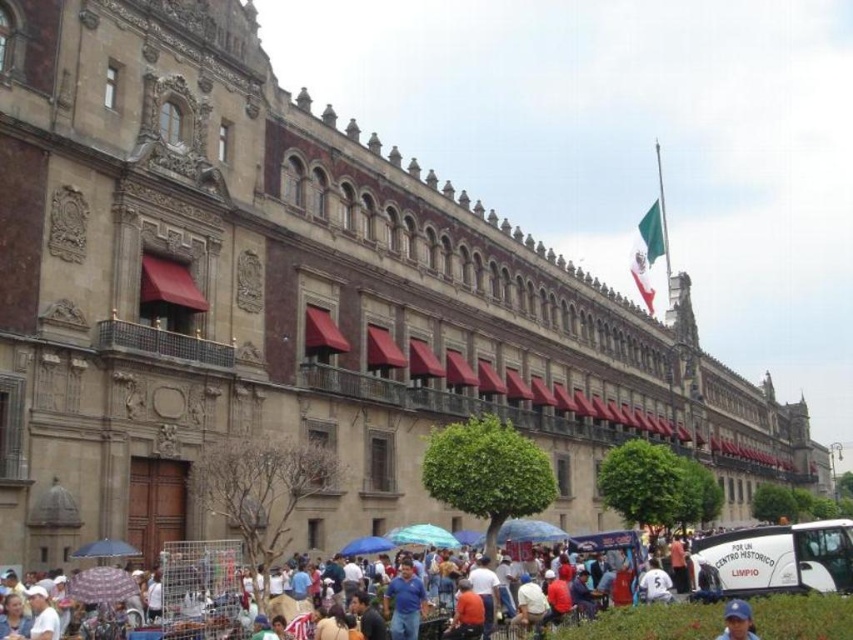
Which is more to the right, light blue fabric umbrella at lower center or blue fabric umbrella at lower center?

light blue fabric umbrella at lower center is more to the right.

Can you confirm if light blue fabric umbrella at lower center is smaller than blue fabric umbrella at lower center?

Incorrect, light blue fabric umbrella at lower center is not smaller in size than blue fabric umbrella at lower center.

Is point (445, 534) more distant than point (376, 541)?

Yes, it is behind point (376, 541).

I want to click on light blue fabric umbrella at lower center, so click(x=422, y=536).

Is white cotton crowd at lower center wider than light blue fabric umbrella at lower center?

Yes.

At what (x,y) coordinates should I click in order to perform the action: click on white cotton crowd at lower center. Please return your answer as a coordinate pair (x, y). The width and height of the screenshot is (853, 640). Looking at the image, I should click on (630, 612).

Is light blue fabric umbrella at lower center positioned at the back of transparent plastic umbrella at lower left?

That is True.

Is point (425, 540) farther from viewer compared to point (125, 552)?

Yes, point (425, 540) is behind point (125, 552).

Which is behind, point (456, 540) or point (119, 540)?

Point (456, 540)

At what (x,y) coordinates should I click in order to perform the action: click on light blue fabric umbrella at lower center. Please return your answer as a coordinate pair (x, y). The width and height of the screenshot is (853, 640). Looking at the image, I should click on coord(422,536).